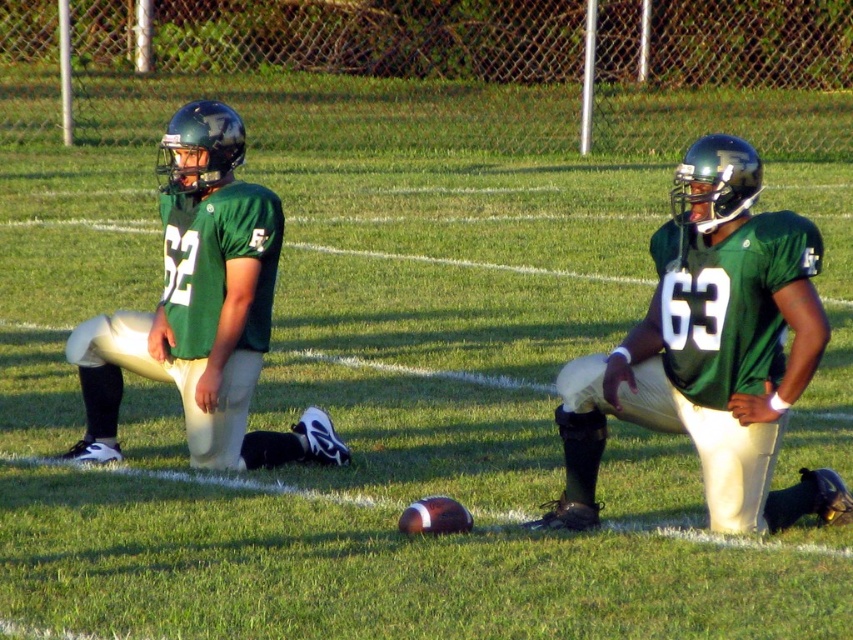
Is green matte jersey at center taller than green matte jersey at left?

In fact, green matte jersey at center may be shorter than green matte jersey at left.

Is green matte jersey at center smaller than green matte jersey at left?

Actually, green matte jersey at center might be larger than green matte jersey at left.

Between point (828, 488) and point (242, 426), which one is positioned in front?

Point (828, 488)

Locate an element on the screen. green matte jersey at center is located at coordinates (711, 352).